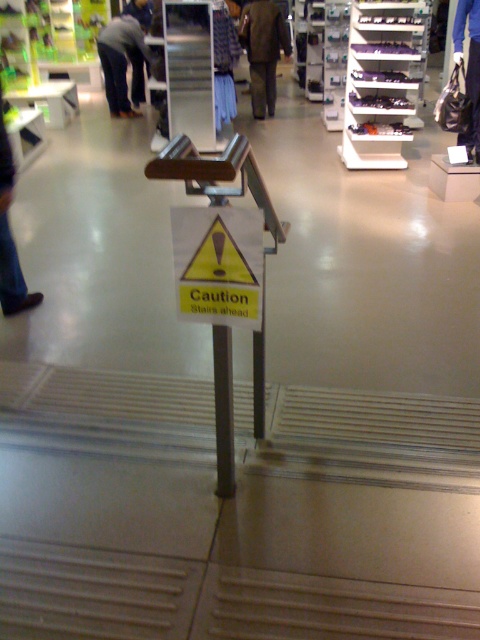
Question: Is the position of yellow paper sign at center more distant than that of dark brown pants at center?

Choices:
 (A) no
 (B) yes

Answer: (A)

Question: Which of these objects is positioned farthest from the dark brown pants at center?

Choices:
 (A) blue jeans at center
 (B) yellow paper sign at center
 (C) dark gray pants at left

Answer: (B)

Question: Does dark brown pants at center have a greater width compared to dark gray pants at left?

Choices:
 (A) yes
 (B) no

Answer: (B)

Question: Which object appears farthest from the camera in this image?

Choices:
 (A) blue jeans at center
 (B) dark gray pants at left
 (C) dark brown pants at center

Answer: (C)

Question: Is yellow paper sign at center thinner than dark gray pants at left?

Choices:
 (A) no
 (B) yes

Answer: (B)

Question: Among these objects, which one is farthest from the camera?

Choices:
 (A) blue jeans at center
 (B) dark gray pants at left
 (C) dark brown pants at center
 (D) yellow paper sign at center

Answer: (C)